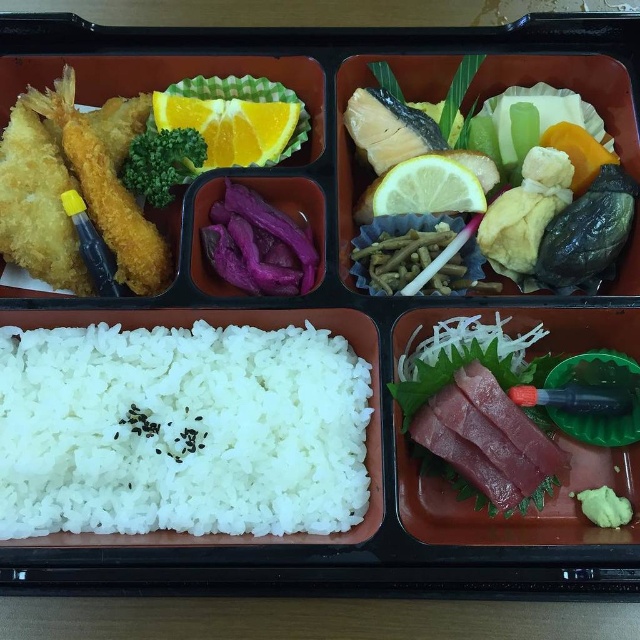
Based on the scene description, which object is taller between the sliced pinkish raw fish at bottom right and the purple matte pickled radish at center?

The sliced pinkish raw fish at bottom right is taller than the purple matte pickled radish at center.

You are looking at the bento box and want to place a new item between the two points, point (220, 276) and point (419, 204). Since you can only place it in front of one of them, which point should you choose to ensure the new item is closer to you?

You should place the new item in front of point (220, 276) because it is closer to you than point (419, 204). Since point (220, 276) is further to the camera than point (419, 204), placing the item in front of it would mean the new item is closer to you.

Based on the scene description, where is the purple matte pickled radish at center located in the bento box?

The purple matte pickled radish at center is located at the center of the bento box, specifically at the coordinates point (257, 244).